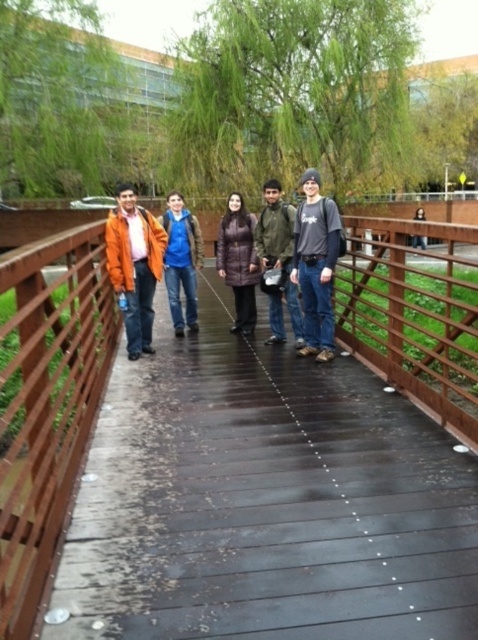
Question: Which object is closer to the camera taking this photo?

Choices:
 (A) matte black jacket at center
 (B) green matte jacket at center
 (C) blue denim jeans at center
 (D) dark gray cotton t-shirt at center

Answer: (A)

Question: Among these points, which one is farthest from the camera?

Choices:
 (A) (37, 589)
 (B) (422, 216)

Answer: (B)

Question: Is the position of brown wooden bridge at center less distant than that of dark gray cotton t-shirt at center?

Choices:
 (A) yes
 (B) no

Answer: (A)

Question: Estimate the real-world distances between objects in this image. Which object is farther from the matte purple coat at center?

Choices:
 (A) orange matte jacket at left
 (B) blue denim jeans at center

Answer: (A)

Question: Can you confirm if matte purple coat at center is bigger than matte black jacket at center?

Choices:
 (A) no
 (B) yes

Answer: (A)

Question: Does orange matte jacket at left have a larger size compared to blue denim jeans at center?

Choices:
 (A) yes
 (B) no

Answer: (B)